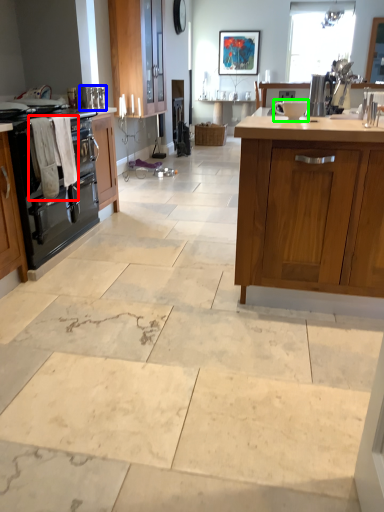
Question: Estimate the real-world distances between objects in this image. Which object is closer to laundry (highlighted by a red box), appliance (highlighted by a blue box) or appliance (highlighted by a green box)?

Choices:
 (A) appliance
 (B) appliance

Answer: (A)